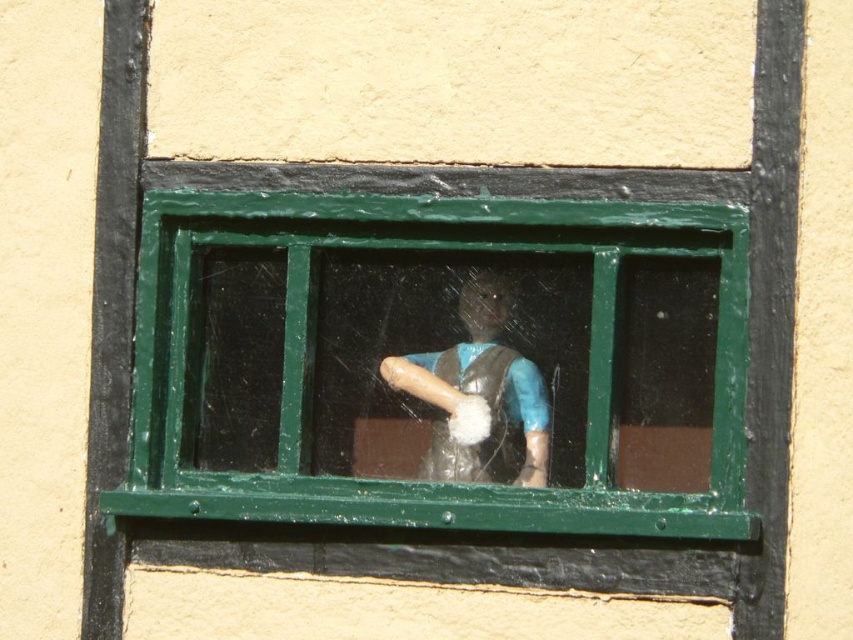
You are a window cleaner who needs to clean the green painted wood window at center without touching the matte plastic figurine at center. Can you safely clean the window with a 3.5 inch wide cloth?

The green painted wood window at center and matte plastic figurine at center are 3.74 inches apart. Since the cloth is 3.5 inches wide, which is slightly narrower than the gap between them, you can safely clean the window without touching the figurine.

You are trying to clean the window and need to reach both the green painted wood window at center and the wooden rolling pin at center. Which object should you clean first if you want to start with the one closer to you?

The green painted wood window at center is closer to the viewer than the wooden rolling pin at center, so you should clean the green painted wood window at center first.